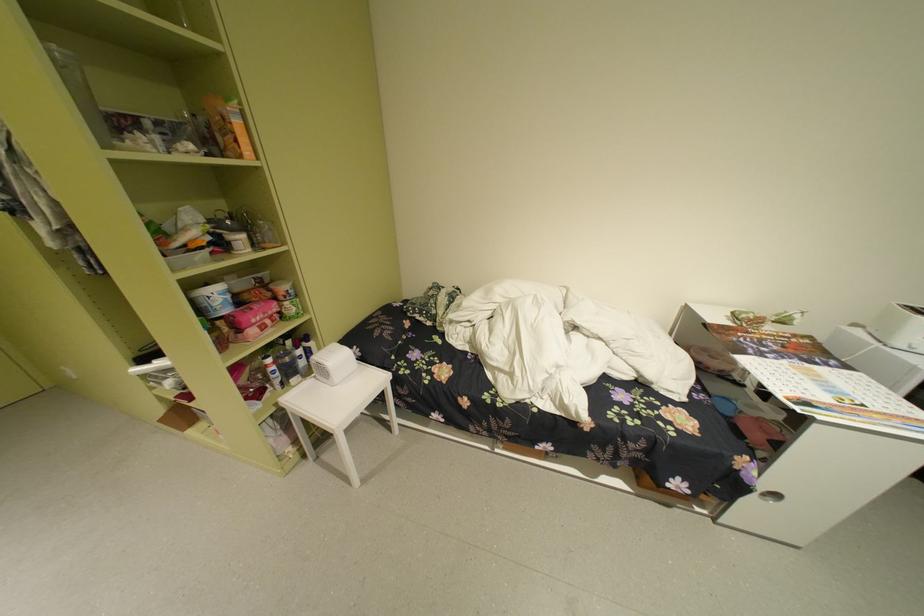
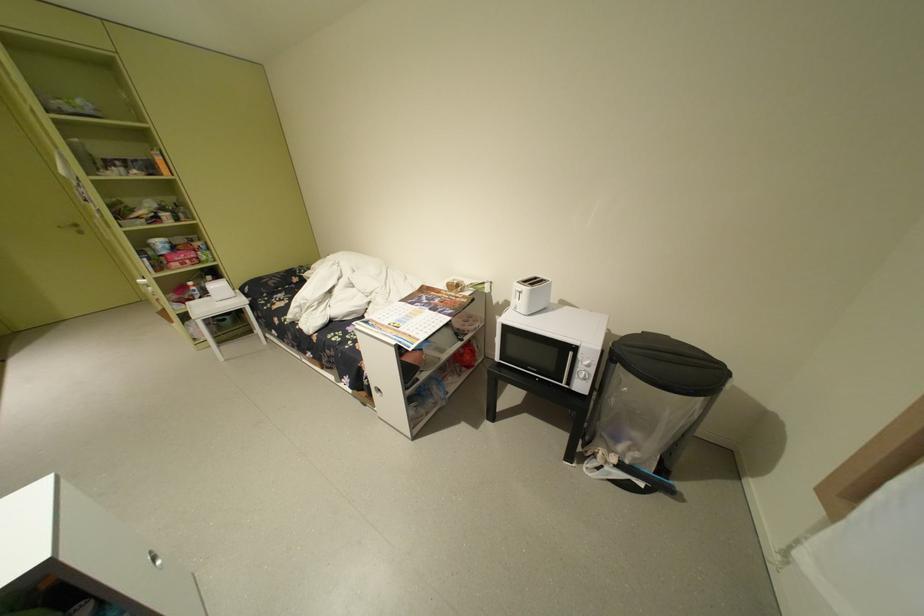
Find the pixel in the second image that matches (285,363) in the first image.

(204, 286)